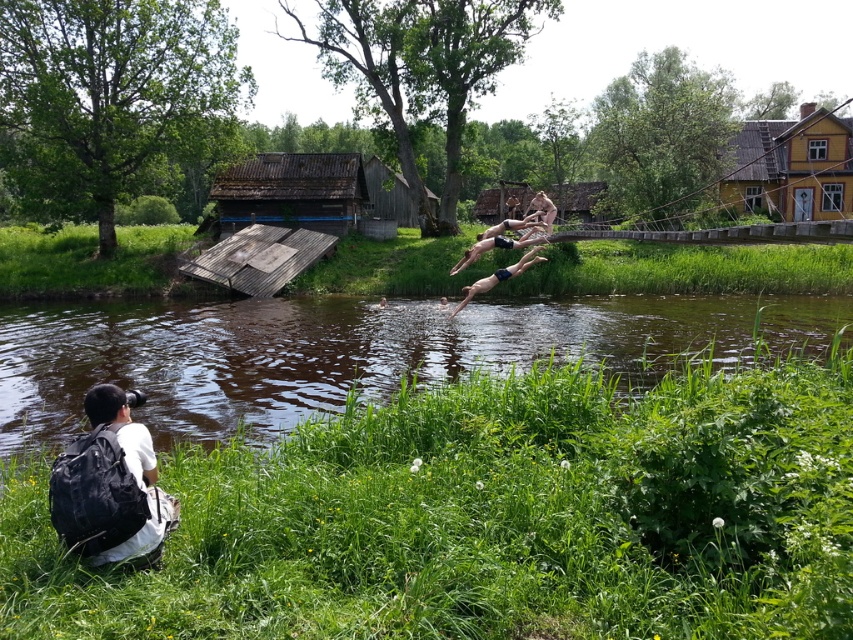
You are standing at the point marked as point (109, 486) in the image. What object is located at this point?

The black backpack at lower left is located at point (109, 486).

You are standing at the point with coordinates point (505, 225) and want to walk to the point with coordinates point (769, 134). Is the destination point behind you or in front of you?

The destination point (769, 134) is behind point (505, 225), so it is behind you.

You are a photographer standing on the grassy bank and want to take a photo of both the black backpack at lower left and the yellow wooden hut at upper right. Which object will appear larger in your photo?

The black backpack at lower left will appear larger in the photo because it is closer to the viewer than the yellow wooden hut at upper right.